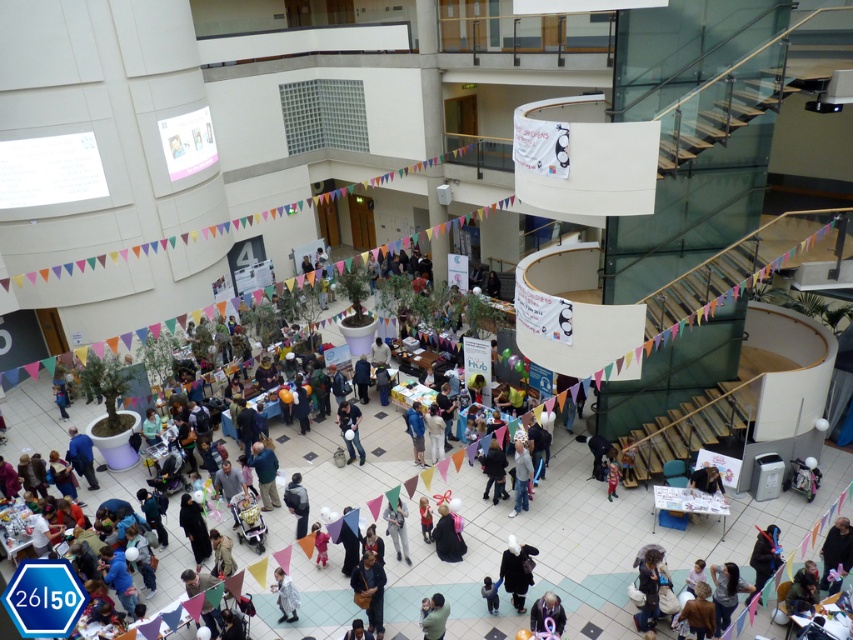
Does light gray fabric jacket at center have a greater height compared to green fabric person at lower center?

Yes, light gray fabric jacket at center is taller than green fabric person at lower center.

Does light gray fabric jacket at center appear under green fabric person at lower center?

No.

Identify the location of light gray fabric jacket at center. This screenshot has width=853, height=640. (521, 477).

Does dark gray jacket at center appear over matte black jacket at center?

No.

Between dark gray jacket at center and matte black jacket at center, which one has less height?

dark gray jacket at center is shorter.

Identify the location of dark gray jacket at center. This screenshot has height=640, width=853. (297, 502).

Image resolution: width=853 pixels, height=640 pixels. Identify the location of dark gray jacket at center. (297, 502).

From the picture: Is light gray fabric jacket at center taller than dark gray jacket at center?

Yes, light gray fabric jacket at center is taller than dark gray jacket at center.

Which is more to the right, light gray fabric jacket at center or dark gray jacket at center?

light gray fabric jacket at center is more to the right.

Locate an element on the screen. light gray fabric jacket at center is located at coordinates (521, 477).

You are a GUI agent. You are given a task and a screenshot of the screen. Output one action in this format:
    pyautogui.click(x=<x>, y=<y>)
    Task: Click on the light gray fabric jacket at center
    
    Given the screenshot: What is the action you would take?
    tap(521, 477)